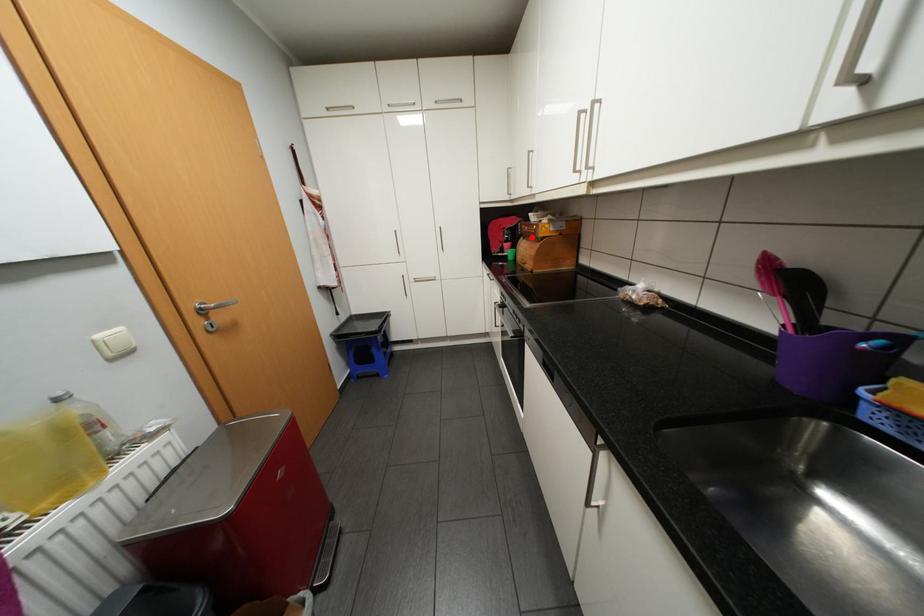
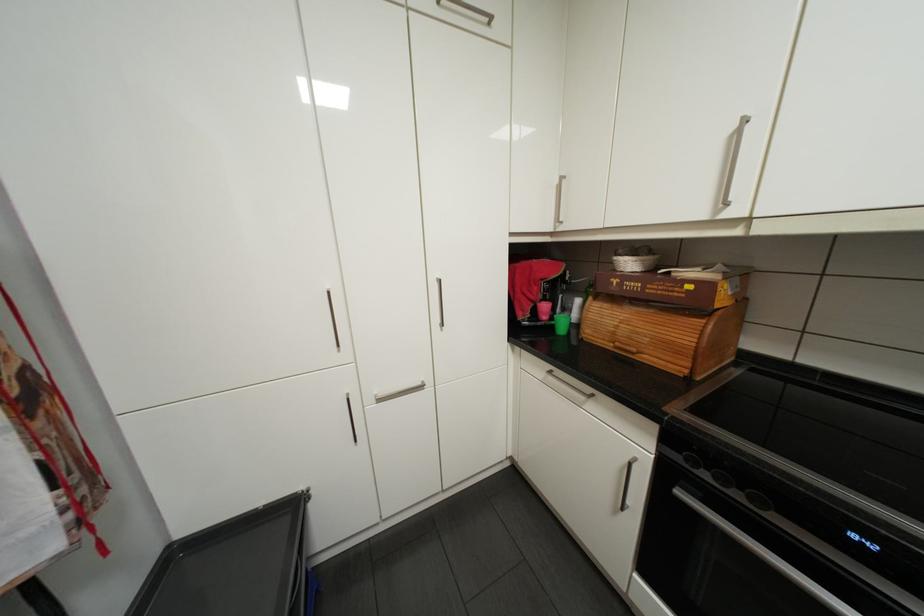
The point at the highlighted location is marked in the first image. Where is the corresponding point in the second image?

(602, 297)